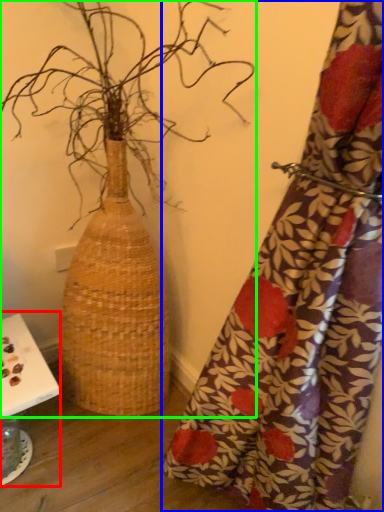
Question: Considering the real-world distances, which object is farthest from table (highlighted by a red box)? curtain (highlighted by a blue box) or houseplant (highlighted by a green box)?

Choices:
 (A) curtain
 (B) houseplant

Answer: (A)